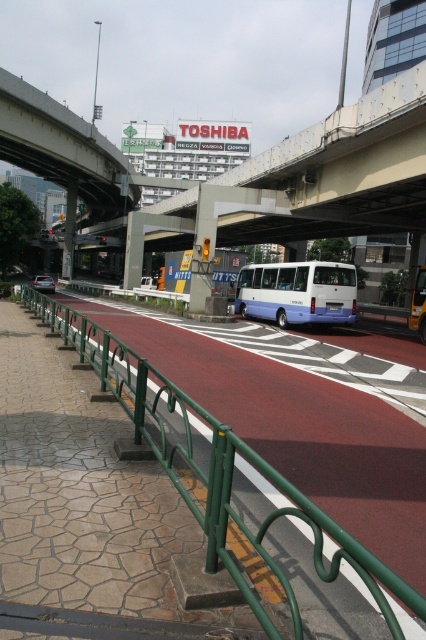
Is green metallic rail at lower left positioned in front of metallic silver car at center?

That is True.

Does green metallic rail at lower left appear over metallic silver car at center?

Incorrect, green metallic rail at lower left is not positioned above metallic silver car at center.

Does point (25, 289) come in front of point (37, 278)?

That is True.

The image size is (426, 640). In order to click on green metallic rail at lower left in this screenshot , I will do `click(218, 470)`.

Does green metallic rail at lower left appear on the right side of white matte bus at center?

Incorrect, green metallic rail at lower left is not on the right side of white matte bus at center.

Which is behind, point (331, 577) or point (348, 266)?

Point (348, 266)

Describe the element at coordinates (218, 470) in the screenshot. The height and width of the screenshot is (640, 426). I see `green metallic rail at lower left` at that location.

Find the location of a particular element. The height and width of the screenshot is (640, 426). green metallic rail at lower left is located at coordinates pos(218,470).

Which is below, white matte bus at center or metallic silver car at center?

white matte bus at center is lower down.

Can you confirm if white matte bus at center is positioned above metallic silver car at center?

Incorrect, white matte bus at center is not positioned above metallic silver car at center.

Is point (247, 289) behind point (43, 282)?

No, (247, 289) is closer to viewer.

Find the location of `white matte bus at center`. white matte bus at center is located at coordinates (298, 292).